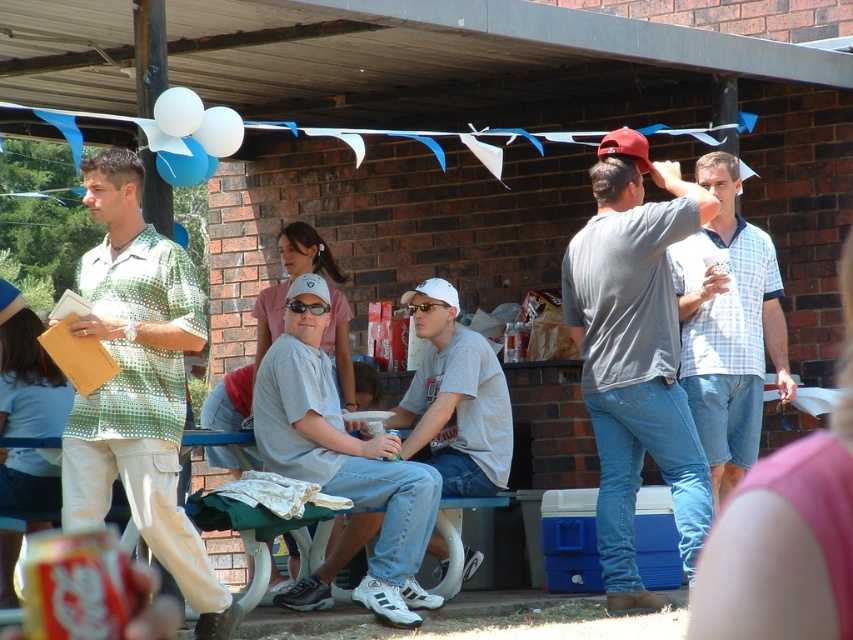
Question: Is green dotted shirt at left to the right of light blue plaid shirt at center from the viewer's perspective?

Choices:
 (A) no
 (B) yes

Answer: (A)

Question: Which of the following is the farthest from the observer?

Choices:
 (A) (767, 234)
 (B) (596, 168)
 (C) (146, 330)

Answer: (A)

Question: Does light blue plaid shirt at center have a larger size compared to gray matte shirt at center?

Choices:
 (A) yes
 (B) no

Answer: (B)

Question: Which object appears farthest from the camera in this image?

Choices:
 (A) gray cotton t-shirt at center
 (B) gray matte shirt at center
 (C) green dotted shirt at left
 (D) light blue plaid shirt at center

Answer: (B)

Question: Does green dotted shirt at left have a larger size compared to gray matte shirt at center?

Choices:
 (A) no
 (B) yes

Answer: (B)

Question: Among these objects, which one is nearest to the camera?

Choices:
 (A) gray matte shirt at center
 (B) light blue plaid shirt at center
 (C) gray cotton t-shirt at center
 (D) green dotted shirt at left

Answer: (D)